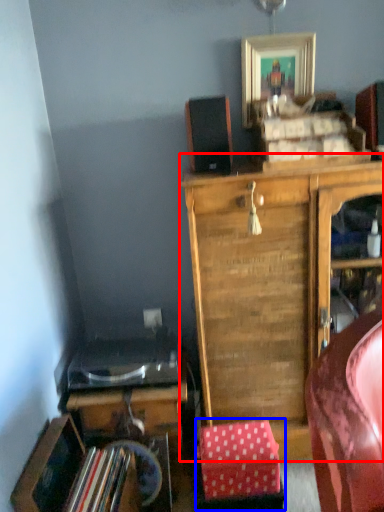
Question: Which of the following is the farthest to the observer, cabinetry (highlighted by a red box) or stool (highlighted by a blue box)?

Choices:
 (A) cabinetry
 (B) stool

Answer: (B)